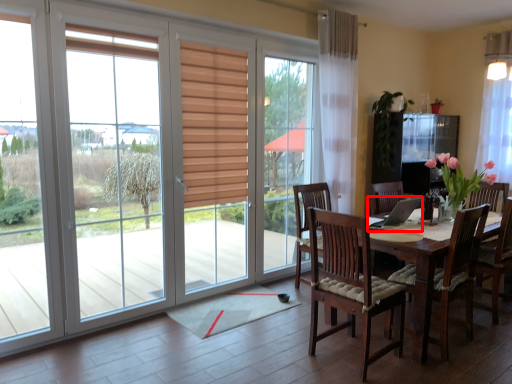
Question: Considering the relative positions of laptop (annotated by the red box) and curtain in the image provided, where is laptop (annotated by the red box) located with respect to the staircase?

Choices:
 (A) right
 (B) left

Answer: (B)